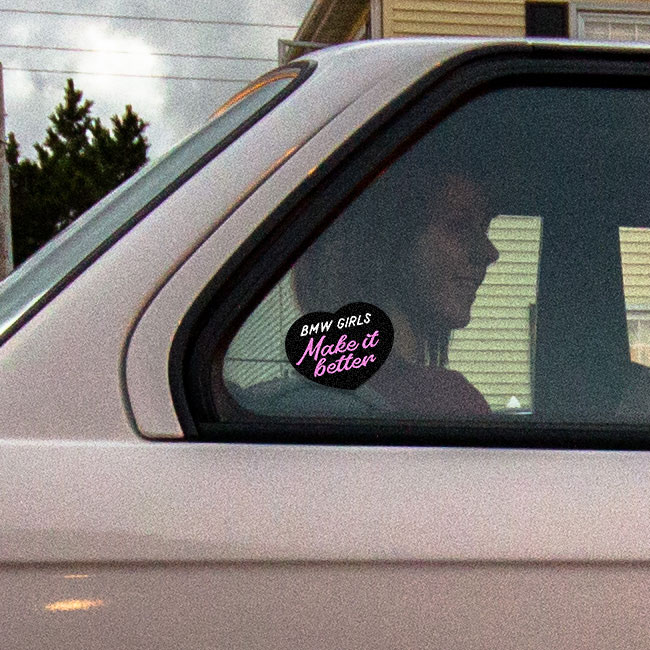
The width and height of the screenshot is (650, 650). Find the location of `window mullions`. window mullions is located at coordinates (634, 30), (608, 32), (638, 325), (590, 32), (640, 344).